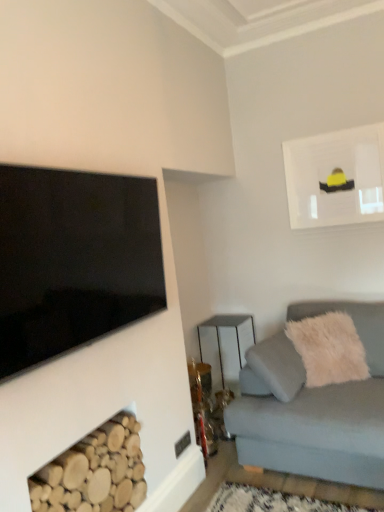
Image resolution: width=384 pixels, height=512 pixels. What do you see at coordinates (225, 326) in the screenshot?
I see `metallic silver table at center` at bounding box center [225, 326].

This screenshot has width=384, height=512. What do you see at coordinates (329, 349) in the screenshot? I see `white fluffy pillow at right` at bounding box center [329, 349].

Identify the location of natural wood logs at lower left. This screenshot has height=512, width=384. (94, 472).

From the image's perspective, would you say white fluffy pillow at right is positioned over black glossy tv at upper left?

Actually, white fluffy pillow at right appears below black glossy tv at upper left in the image.

Is point (344, 335) positioned in front of point (139, 270)?

No, (344, 335) is further to viewer.

Does white fluffy pillow at right have a smaller size compared to black glossy tv at upper left?

No.

Based on the photo, is black glossy tv at upper left a part of white fluffy pillow at right?

Definitely not — black glossy tv at upper left is not inside white fluffy pillow at right.

Is light gray fabric couch at lower right to the left or to the right of metallic silver table at center in the image?

light gray fabric couch at lower right is to the right of metallic silver table at center.

In terms of height, does light gray fabric couch at lower right look taller or shorter compared to metallic silver table at center?

Considering their sizes, light gray fabric couch at lower right has more height than metallic silver table at center.

Is light gray fabric couch at lower right bigger or smaller than metallic silver table at center?

light gray fabric couch at lower right is bigger than metallic silver table at center.

Which object is positioned more to the left, light gray fabric couch at lower right or white fluffy pillow at right?

Positioned to the left is light gray fabric couch at lower right.

Are light gray fabric couch at lower right and white fluffy pillow at right beside each other?

No, light gray fabric couch at lower right is not beside white fluffy pillow at right.

Based on the photo, can you confirm if light gray fabric couch at lower right is wider than white fluffy pillow at right?

Correct, the width of light gray fabric couch at lower right exceeds that of white fluffy pillow at right.

How many degrees apart are the facing directions of light gray fabric couch at lower right and white fluffy pillow at right?

39.7 degrees.

Is point (129, 449) closer or farther from the camera than point (368, 336)?

Point (129, 449).

Which of these two, natural wood logs at lower left or light gray fabric couch at lower right, is thinner?

natural wood logs at lower left.

Is natural wood logs at lower left spatially inside light gray fabric couch at lower right, or outside of it?

natural wood logs at lower left exists outside the volume of light gray fabric couch at lower right.

Is black glossy tv at upper left to the left of light gray fabric couch at lower right from the viewer's perspective?

Indeed, black glossy tv at upper left is positioned on the left side of light gray fabric couch at lower right.

From the picture: Are black glossy tv at upper left and light gray fabric couch at lower right far apart?

Yes, black glossy tv at upper left and light gray fabric couch at lower right are located far from each other.

Is metallic silver table at center inside or outside of black glossy tv at upper left?

metallic silver table at center cannot be found inside black glossy tv at upper left.

From a real-world perspective, who is located lower, metallic silver table at center or black glossy tv at upper left?

metallic silver table at center.

Can you confirm if metallic silver table at center is shorter than black glossy tv at upper left?

No, metallic silver table at center is not shorter than black glossy tv at upper left.

From a real-world perspective, is metallic silver table at center positioned over white fluffy pillow at right based on gravity?

No, from a real-world perspective, metallic silver table at center is not above white fluffy pillow at right.

Is metallic silver table at center oriented towards white fluffy pillow at right?

Yes, metallic silver table at center faces towards white fluffy pillow at right.

Is the position of metallic silver table at center less distant than that of white fluffy pillow at right?

No, it is behind white fluffy pillow at right.

Identify the location of television above the white fluffy pillow at right (from the image's perspective). The height and width of the screenshot is (512, 384). [x=74, y=260].

This screenshot has width=384, height=512. What are the coordinates of `table that is behind the light gray fabric couch at lower right` in the screenshot? It's located at (225, 326).

Considering their positions, is black glossy tv at upper left positioned closer to metallic silver table at center than natural wood logs at lower left?

natural wood logs at lower left is closer to metallic silver table at center.

Which object lies further to the anchor point light gray fabric couch at lower right, white fluffy pillow at right or natural wood logs at lower left?

natural wood logs at lower left is further to light gray fabric couch at lower right.

Based on their spatial positions, is light gray fabric couch at lower right or black glossy tv at upper left closer to matte white picture frame at upper right?

light gray fabric couch at lower right.

Based on their spatial positions, is light gray fabric couch at lower right or matte white picture frame at upper right closer to black glossy tv at upper left?

light gray fabric couch at lower right is closer to black glossy tv at upper left.

From the image, which object appears to be nearer to matte white picture frame at upper right, white fluffy pillow at right or natural wood logs at lower left?

white fluffy pillow at right.

Which object lies further to the anchor point matte white picture frame at upper right, natural wood logs at lower left or light gray fabric couch at lower right?

natural wood logs at lower left is positioned further to the anchor matte white picture frame at upper right.

In the scene shown: Estimate the real-world distances between objects in this image. Which object is further from natural wood logs at lower left, matte white picture frame at upper right or black glossy tv at upper left?

The object further to natural wood logs at lower left is matte white picture frame at upper right.

Based on the photo, based on their spatial positions, is matte white picture frame at upper right or light gray fabric couch at lower right further from black glossy tv at upper left?

matte white picture frame at upper right is further to black glossy tv at upper left.

I want to click on pillow between black glossy tv at upper left and matte white picture frame at upper right along the z-axis, so click(x=329, y=349).

Image resolution: width=384 pixels, height=512 pixels. Identify the location of pillow positioned between black glossy tv at upper left and metallic silver table at center from near to far. (329, 349).

Identify the location of studio couch positioned between black glossy tv at upper left and metallic silver table at center from near to far. Image resolution: width=384 pixels, height=512 pixels. (313, 406).

Locate an element on the screen. picture frame between natural wood logs at lower left and metallic silver table at center from front to back is located at coordinates (336, 177).